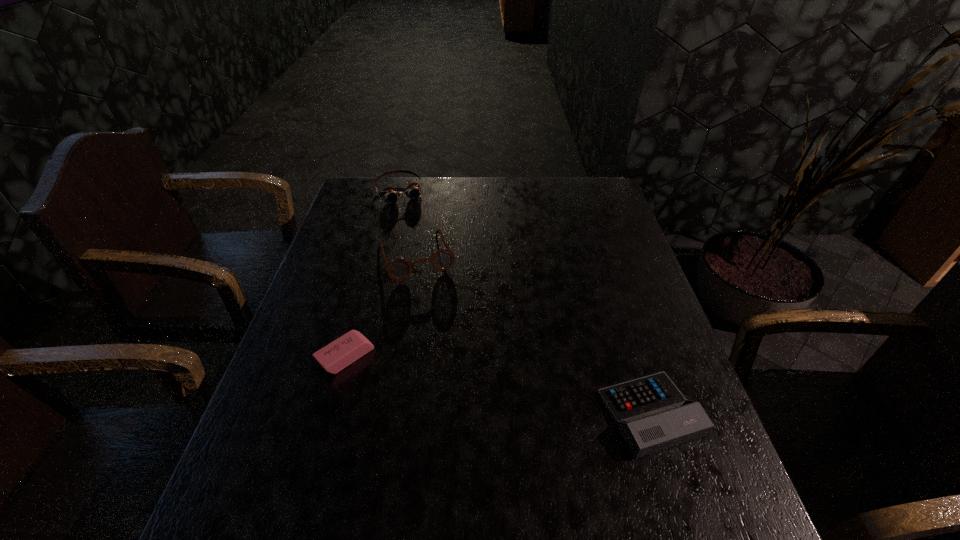
Where is `vacant point located 0.400m on the front-facing side of the tallest object`? This screenshot has width=960, height=540. vacant point located 0.400m on the front-facing side of the tallest object is located at coordinates (472, 402).

The image size is (960, 540). I want to click on free space located 0.140m through the lenses of the farthest object, so click(415, 228).

Locate an element on the screen. The width and height of the screenshot is (960, 540). free space located through the lenses of the farthest object is located at coordinates (410, 218).

This screenshot has width=960, height=540. What are the coordinates of `free space located through the lenses of the farthest object` in the screenshot? It's located at (433, 268).

This screenshot has width=960, height=540. What are the coordinates of `object present at the far edge` in the screenshot? It's located at (391, 195).

Find the location of a particular element. The height and width of the screenshot is (540, 960). object that is at the near edge is located at coordinates (651, 413).

Find the location of a particular element. This screenshot has height=540, width=960. eraser at the left edge is located at coordinates (337, 355).

Locate an element on the screen. Image resolution: width=960 pixels, height=540 pixels. spectacles located at the left edge is located at coordinates (398, 269).

Identify the location of goggles that is at the left edge. (391, 195).

Find the location of `object positioned at the right edge`. object positioned at the right edge is located at coordinates click(651, 413).